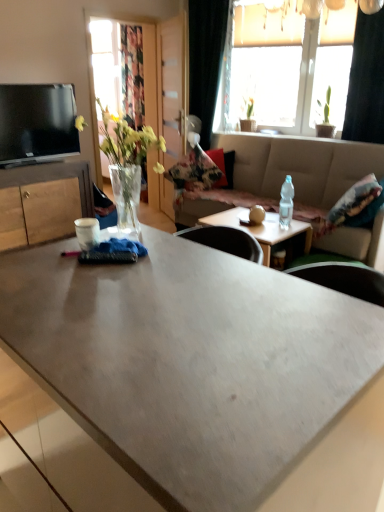
The image size is (384, 512). I want to click on free point above matte concrete coffee table at center, which is counted as the second coffee table, starting from the back (from a real-world perspective), so click(x=172, y=327).